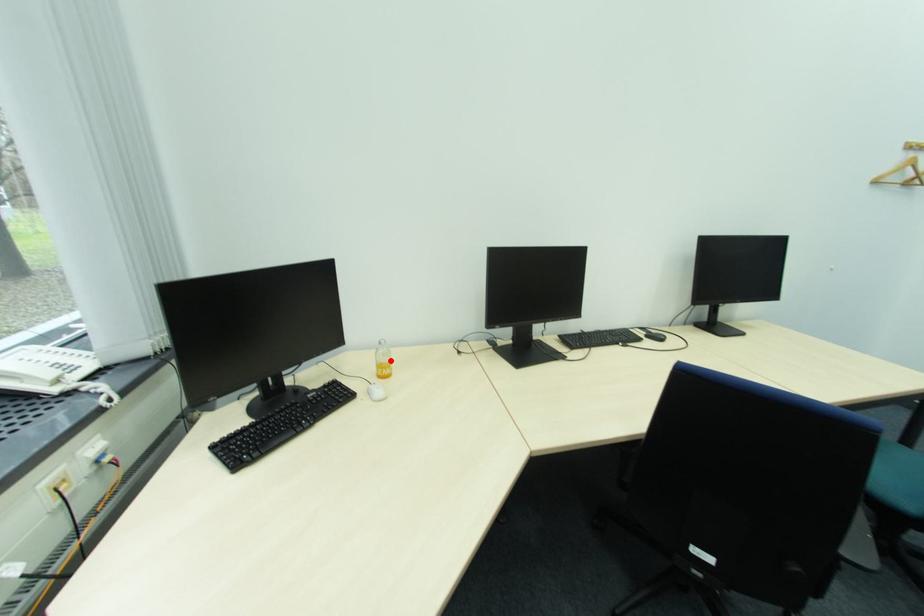
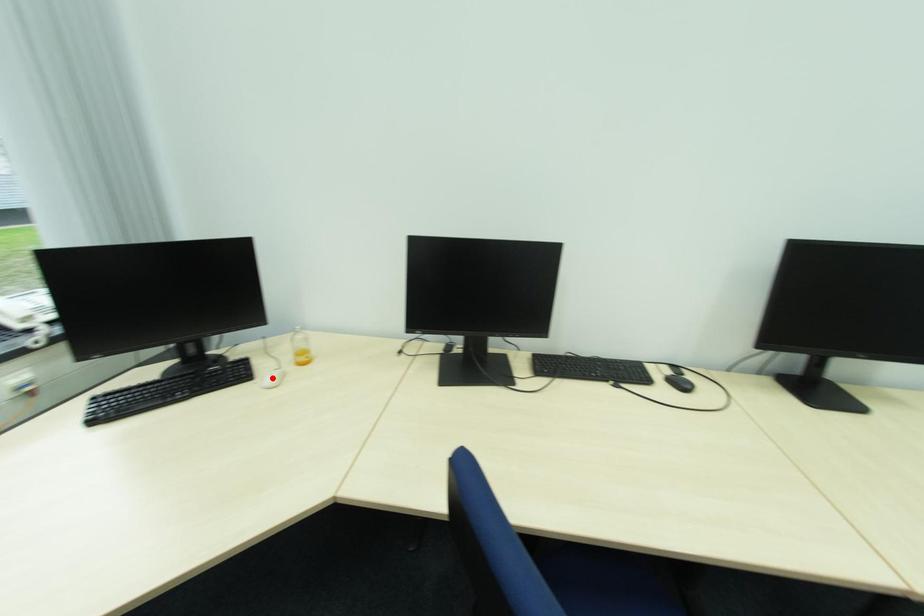
I am providing you with two images of the same scene from different viewpoints. A red point is marked on the first image and another point is marked on the second image. Does the point marked in image1 correspond to the same location as the one in image2?

No